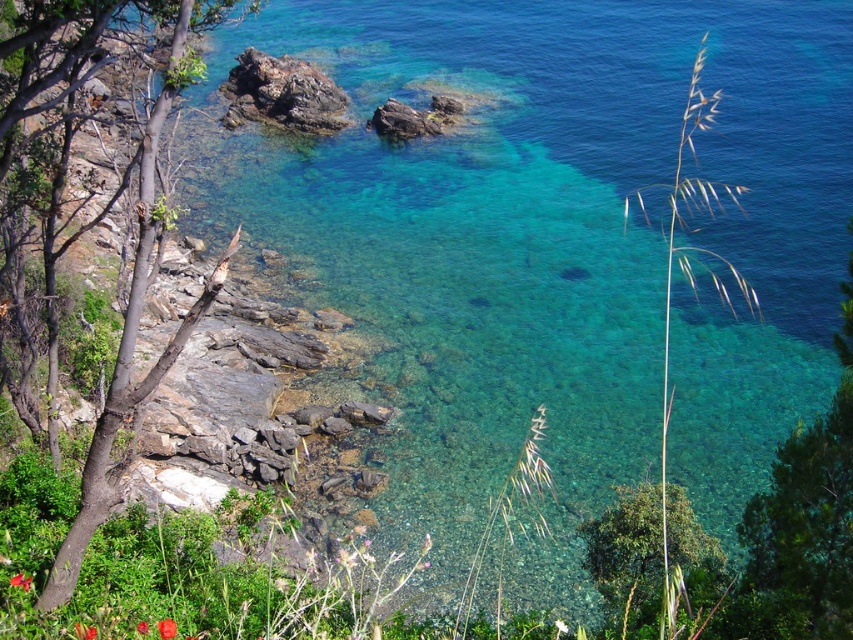
Question: Which is farther from the bright red petal at lower left?

Choices:
 (A) red matte flower at lower left
 (B) brown bark tree at left

Answer: (B)

Question: Is green leafy tree at lower right thinner than bright red petal at center?

Choices:
 (A) yes
 (B) no

Answer: (B)

Question: From the image, what is the correct spatial relationship of brown bark tree at left in relation to red matte flower at lower left?

Choices:
 (A) above
 (B) below

Answer: (A)

Question: Estimate the real-world distances between objects in this image. Which object is farther from the red matte flower at lower left?

Choices:
 (A) brown bark tree at left
 (B) bright red petal at center
 (C) bright red petal at lower left
 (D) green leafy tree at lower right

Answer: (D)

Question: Which point is farther from the camera taking this photo?

Choices:
 (A) (717, 545)
 (B) (148, 627)

Answer: (A)

Question: Is green leafy tree at lower right further to camera compared to smooth glossy rose at center?

Choices:
 (A) yes
 (B) no

Answer: (A)